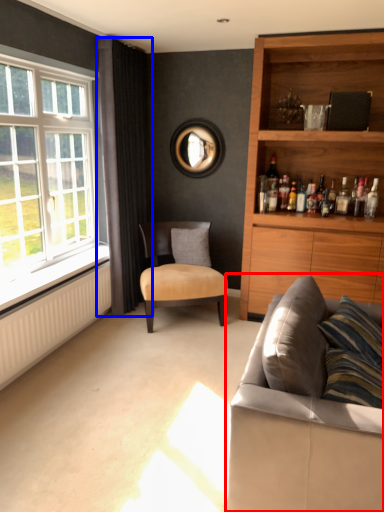
Question: Which object appears closest to the camera in this image, studio couch (highlighted by a red box) or curtain (highlighted by a blue box)?

Choices:
 (A) studio couch
 (B) curtain

Answer: (A)